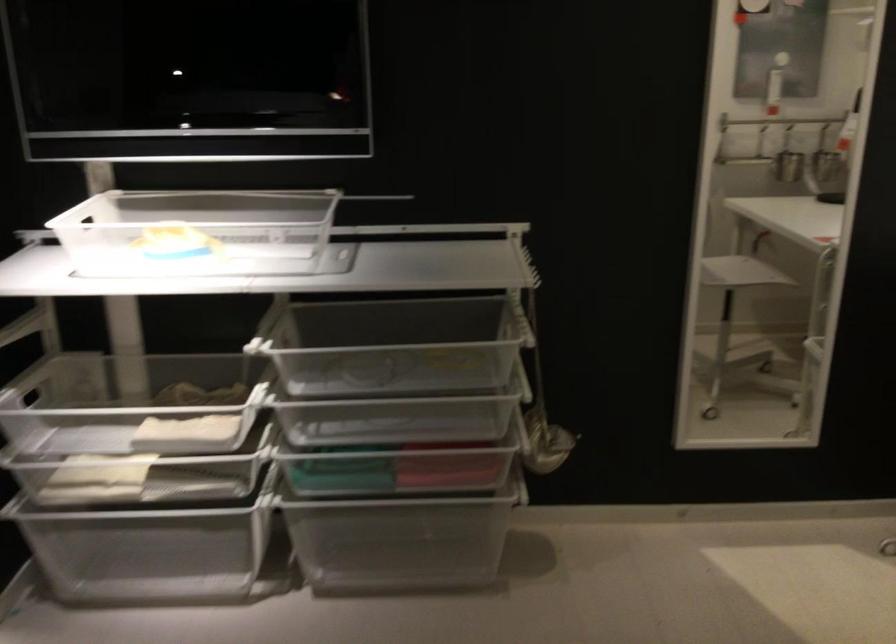
Find where to lift the metal ladle. Please return your answer as a coordinate pair (x, y).

(541, 415)